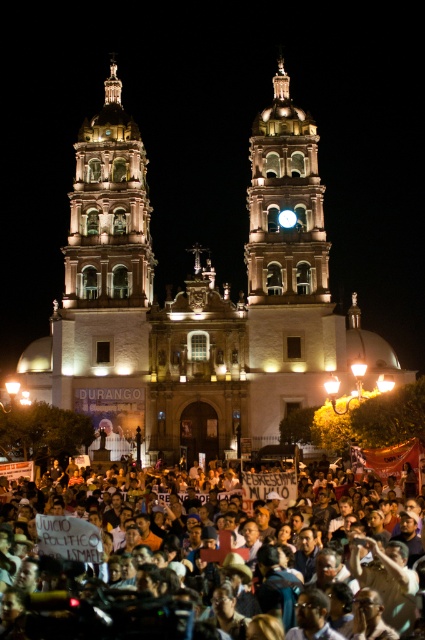
Question: Which point appears closest to the camera in this image?

Choices:
 (A) (167, 637)
 (B) (127, 440)

Answer: (A)

Question: Is illuminated stone church at center to the left of dark skin crowd at lower center from the viewer's perspective?

Choices:
 (A) no
 (B) yes

Answer: (A)

Question: Which point is farther from the camera taking this photo?

Choices:
 (A) (336, 348)
 (B) (139, 630)

Answer: (A)

Question: Which point is closer to the camera?

Choices:
 (A) illuminated stone church at center
 (B) dark skin crowd at lower center

Answer: (B)

Question: Where is illuminated stone church at center located in relation to dark skin crowd at lower center in the image?

Choices:
 (A) above
 (B) below

Answer: (A)

Question: Does illuminated stone church at center appear on the left side of dark skin crowd at lower center?

Choices:
 (A) yes
 (B) no

Answer: (B)